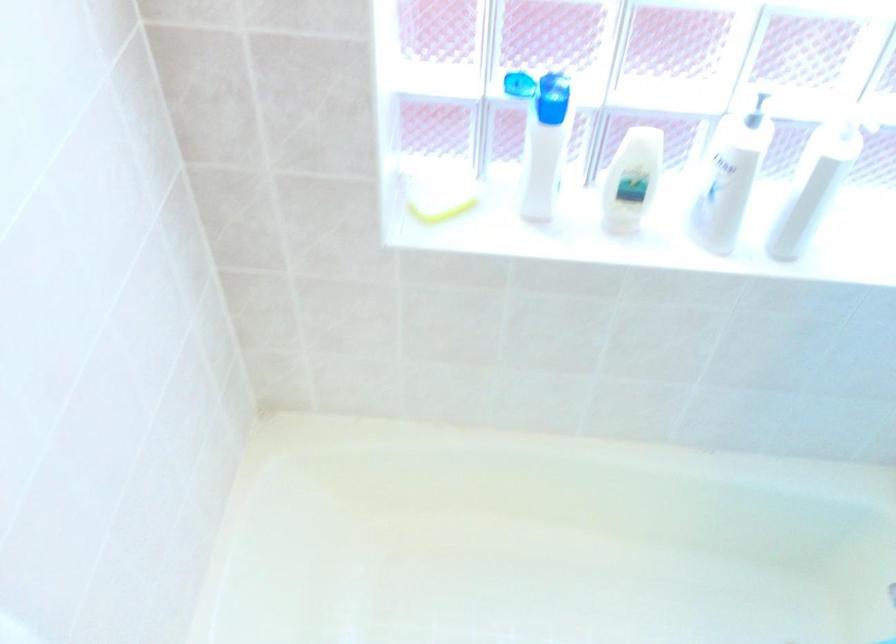
You are a GUI agent. You are given a task and a screenshot of the screen. Output one action in this format:
    pyautogui.click(x=<x>, y=<y>)
    Task: Click on the white pump dispenser
    The image size is (896, 644).
    Given the screenshot: What is the action you would take?
    pyautogui.click(x=721, y=211)